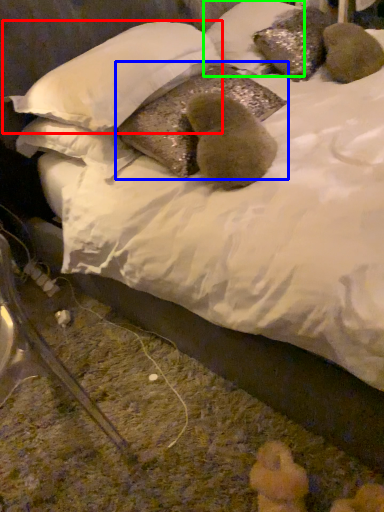
Question: Considering the real-world distances, which object is closest to pillow (highlighted by a red box)? pillow (highlighted by a blue box) or pillow (highlighted by a green box).

Choices:
 (A) pillow
 (B) pillow

Answer: (A)